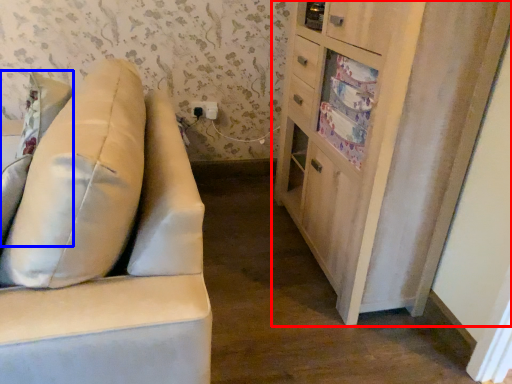
Question: Which of the following is the farthest to the observer, cabinetry (highlighted by a red box) or pillow (highlighted by a blue box)?

Choices:
 (A) cabinetry
 (B) pillow

Answer: (A)